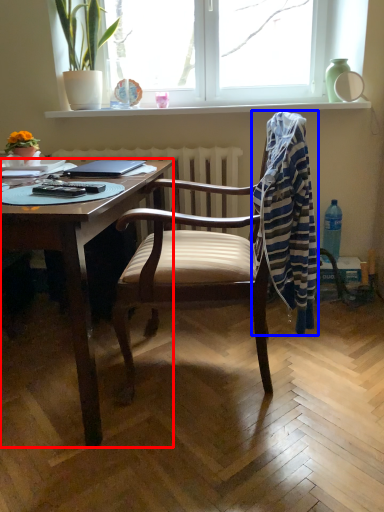
Question: Among these objects, which one is farthest to the camera, desk (highlighted by a red box) or laundry (highlighted by a blue box)?

Choices:
 (A) desk
 (B) laundry

Answer: (B)